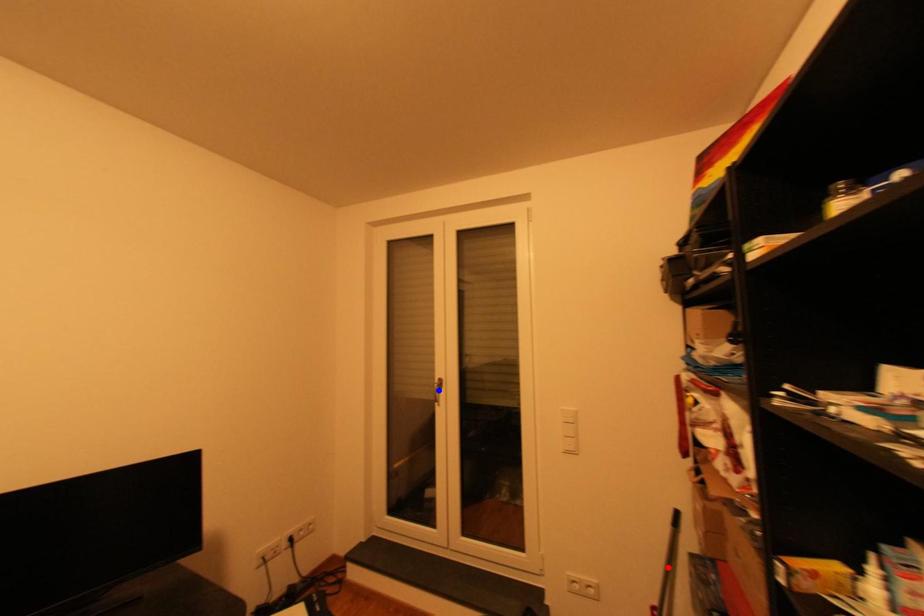
Question: In the image, two points are highlighted. Which point is nearer to the camera? Reply with the corresponding letter.

Choices:
 (A) blue point
 (B) red point

Answer: (B)